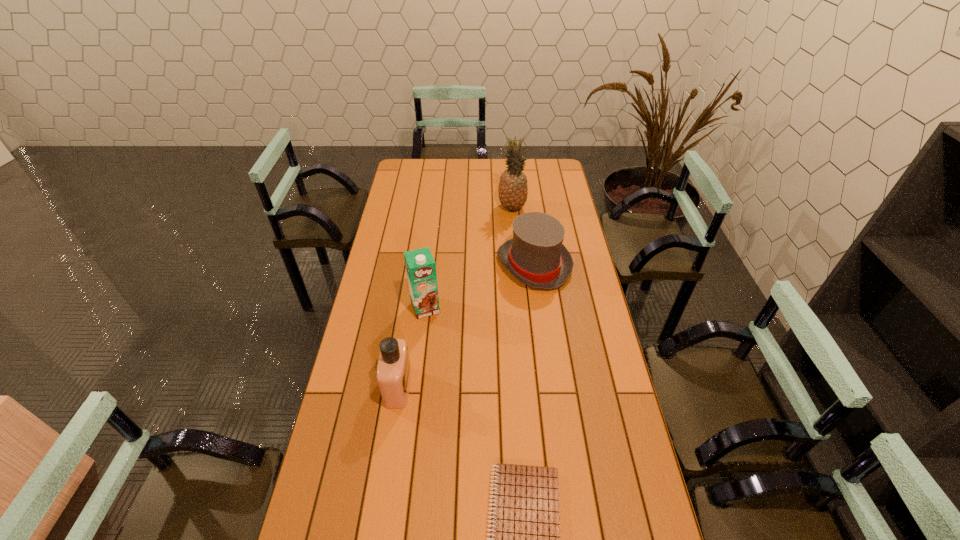
Identify the location of pineapple. (512, 189).

What are the coordinates of `the farthest object` in the screenshot? It's located at (512, 189).

Where is `the third farthest object`? This screenshot has height=540, width=960. the third farthest object is located at coordinates (420, 265).

Where is `carton`? carton is located at coordinates (420, 265).

You are a GUI agent. You are given a task and a screenshot of the screen. Output one action in this format:
    pyautogui.click(x=<x>, y=<y>)
    Task: Click on the perfume
    The height and width of the screenshot is (540, 960).
    Given the screenshot: What is the action you would take?
    pyautogui.click(x=393, y=370)

The height and width of the screenshot is (540, 960). I want to click on dress hat, so click(x=535, y=256).

Locate an element on the screen. The width and height of the screenshot is (960, 540). vacant space located on the front of the pineapple is located at coordinates (516, 258).

Where is `vacant region located 0.320m on the back of the third farthest object`? The image size is (960, 540). vacant region located 0.320m on the back of the third farthest object is located at coordinates (433, 244).

The image size is (960, 540). Find the location of `vacant area situated on the front label of the perfume`. vacant area situated on the front label of the perfume is located at coordinates (522, 387).

Locate an element on the screen. This screenshot has width=960, height=540. free point located 0.400m on the left of the dress hat is located at coordinates (400, 265).